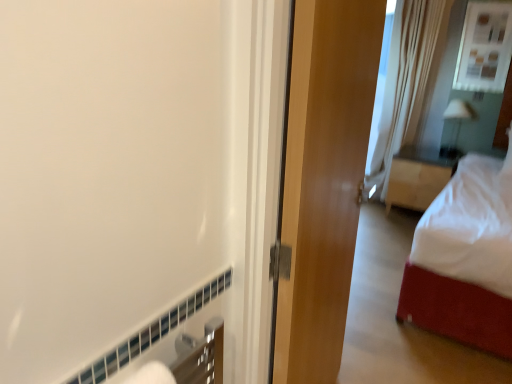
What do you see at coordinates (456, 124) in the screenshot? The image size is (512, 384). I see `white glossy lamp at upper right` at bounding box center [456, 124].

What do you see at coordinates (415, 183) in the screenshot? I see `wooden nightstand at right` at bounding box center [415, 183].

This screenshot has width=512, height=384. Identify the location of white soft bed at right. (465, 258).

The image size is (512, 384). Describe the element at coordinates (484, 47) in the screenshot. I see `matte glass window at upper right` at that location.

At what (x,y) coordinates should I click in order to perform the action: click on white sheer curtain at right. Please return your answer as a coordinate pair (x, y). The height and width of the screenshot is (384, 512). Looking at the image, I should click on (406, 82).

Find the location of a particular element. This screenshot has width=512, height=384. white glossy lamp at upper right is located at coordinates (456, 124).

Considering the positions of points (453, 145) and (400, 189), is point (453, 145) farther from camera compared to point (400, 189)?

That is True.

Measure the distance from white glossy lamp at upper right to wooden nightstand at right.

white glossy lamp at upper right is 46.10 centimeters away from wooden nightstand at right.

Is white glossy lamp at upper right positioned with its back to wooden nightstand at right?

No.

Looking at this image, which is more to the left, white sheer curtain at right or matte glass window at upper right?

white sheer curtain at right is more to the left.

Is white sheer curtain at right outside of matte glass window at upper right?

Absolutely, white sheer curtain at right is external to matte glass window at upper right.

Is white sheer curtain at right aimed at matte glass window at upper right?

No, white sheer curtain at right is not turned towards matte glass window at upper right.

Looking at their sizes, would you say white sheer curtain at right is wider or thinner than matte glass window at upper right?

Considering their sizes, white sheer curtain at right looks broader than matte glass window at upper right.

Considering the sizes of objects white soft bed at right and white glossy lamp at upper right in the image provided, who is thinner, white soft bed at right or white glossy lamp at upper right?

With smaller width is white glossy lamp at upper right.

From a real-world perspective, is white soft bed at right positioned above or below white glossy lamp at upper right?

In terms of real-world spatial position, white soft bed at right is above white glossy lamp at upper right.

Is white soft bed at right oriented towards white glossy lamp at upper right?

No, white soft bed at right is not turned towards white glossy lamp at upper right.

Is white sheer curtain at right closer to camera compared to wooden nightstand at right?

That is False.

Can you confirm if white sheer curtain at right is positioned to the right of wooden nightstand at right?

In fact, white sheer curtain at right is to the left of wooden nightstand at right.

How many degrees apart are the facing directions of white sheer curtain at right and wooden nightstand at right?

The facing directions of white sheer curtain at right and wooden nightstand at right are 25.5 degrees apart.

Is white sheer curtain at right taller than wooden nightstand at right?

Correct, white sheer curtain at right is much taller as wooden nightstand at right.

You are a GUI agent. You are given a task and a screenshot of the screen. Output one action in this format:
    pyautogui.click(x=<x>, y=<y>)
    Task: Click on the furniture on the right of glossy wood door at center
    
    Given the screenshot: What is the action you would take?
    pyautogui.click(x=415, y=183)

Is glossy wood door at center positioned with its back to wooden nightstand at right?

glossy wood door at center is not turned away from wooden nightstand at right.

Is glossy wood door at center placed right next to wooden nightstand at right?

No, glossy wood door at center is not with wooden nightstand at right.

In terms of width, does glossy wood door at center look wider or thinner when compared to wooden nightstand at right?

Clearly, glossy wood door at center has less width compared to wooden nightstand at right.

Between matte glass window at upper right and glossy wood door at center, which one has larger size?

With larger size is glossy wood door at center.

Which object is further away from the camera, matte glass window at upper right or glossy wood door at center?

matte glass window at upper right is more distant.

Is matte glass window at upper right completely or partially outside of glossy wood door at center?

Indeed, matte glass window at upper right is completely outside glossy wood door at center.

From the image's perspective, which is above, matte glass window at upper right or glossy wood door at center?

matte glass window at upper right is shown above in the image.

Between glossy wood door at center and white sheer curtain at right, which one is positioned in front?

glossy wood door at center is more forward.

What's the angular difference between glossy wood door at center and white sheer curtain at right's facing directions?

There is a 46.5-degree angle between the facing directions of glossy wood door at center and white sheer curtain at right.

Is point (335, 254) behind point (376, 152)?

No, (335, 254) is in front of (376, 152).

Which object is wider, glossy wood door at center or white sheer curtain at right?

Wider between the two is white sheer curtain at right.

Locate an element on the screen. furniture on the left side of white glossy lamp at upper right is located at coordinates (415, 183).

There is a white sheer curtain at right. At what (x,y) coordinates should I click in order to perform the action: click on window above it (from a real-world perspective). Please return your answer as a coordinate pair (x, y). The height and width of the screenshot is (384, 512). Looking at the image, I should click on (484, 47).

Estimate the real-world distances between objects in this image. Which object is closer to white soft bed at right, white sheer curtain at right or wooden nightstand at right?

The object closer to white soft bed at right is wooden nightstand at right.

In the scene shown: From the image, which object appears to be farther from glossy wood door at center, white soft bed at right or wooden nightstand at right?

Among the two, wooden nightstand at right is located further to glossy wood door at center.

Looking at the image, which one is located closer to matte glass window at upper right, wooden nightstand at right or glossy wood door at center?

wooden nightstand at right is positioned closer to the anchor matte glass window at upper right.

Estimate the real-world distances between objects in this image. Which object is further from white soft bed at right, white sheer curtain at right or matte glass window at upper right?

The object further to white soft bed at right is white sheer curtain at right.

Considering their positions, is glossy wood door at center positioned further to matte glass window at upper right than white glossy lamp at upper right?

Based on the image, glossy wood door at center appears to be further to matte glass window at upper right.

Estimate the real-world distances between objects in this image. Which object is further from white soft bed at right, glossy wood door at center or white glossy lamp at upper right?

white glossy lamp at upper right is positioned further to the anchor white soft bed at right.

From the image, which object appears to be farther from white soft bed at right, wooden nightstand at right or white glossy lamp at upper right?

white glossy lamp at upper right lies further to white soft bed at right than the other object.

Estimate the real-world distances between objects in this image. Which object is closer to wooden nightstand at right, glossy wood door at center or white glossy lamp at upper right?

The object closer to wooden nightstand at right is white glossy lamp at upper right.

Locate an element on the screen. bed located between glossy wood door at center and wooden nightstand at right in the depth direction is located at coordinates (465, 258).

Where is `shower curtain between matte glass window at upper right and white glossy lamp at upper right in the vertical direction`? The height and width of the screenshot is (384, 512). shower curtain between matte glass window at upper right and white glossy lamp at upper right in the vertical direction is located at coordinates (406, 82).

The height and width of the screenshot is (384, 512). In order to click on furniture located between white soft bed at right and white sheer curtain at right in the depth direction in this screenshot , I will do `click(415, 183)`.

Locate an element on the screen. window between glossy wood door at center and white glossy lamp at upper right along the z-axis is located at coordinates (484, 47).